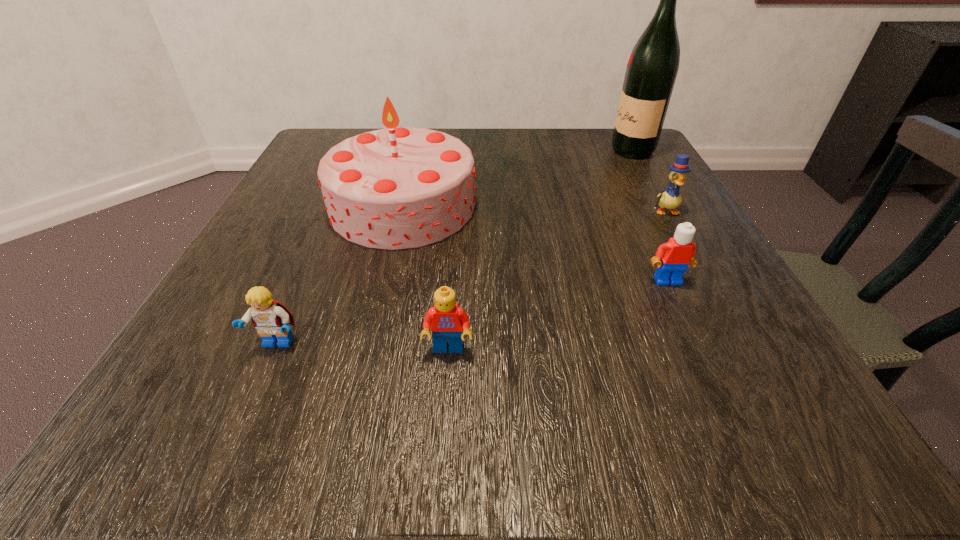
Find the location of a particular element. This screenshot has width=960, height=540. the tallest object is located at coordinates (653, 65).

This screenshot has height=540, width=960. What are the coordinates of `the farthest object` in the screenshot? It's located at (653, 65).

The width and height of the screenshot is (960, 540). Find the location of `birthday cake`. birthday cake is located at coordinates (x=395, y=188).

In order to click on duckling in this screenshot , I will do `click(671, 198)`.

Where is `the third nearest object`? This screenshot has width=960, height=540. the third nearest object is located at coordinates (676, 255).

I want to click on the rightmost Lego, so click(676, 255).

This screenshot has height=540, width=960. Find the location of `the second Lego from left to right`. the second Lego from left to right is located at coordinates (446, 319).

Image resolution: width=960 pixels, height=540 pixels. Identify the location of the leftmost Lego. (271, 318).

In order to click on free space located on the front-facing side of the tallest object in this screenshot , I will do `click(463, 151)`.

You are a GUI agent. You are given a task and a screenshot of the screen. Output one action in this format:
    pyautogui.click(x=<x>, y=<y>)
    Task: Click on the vacant space located 0.140m on the front-facing side of the tallest object
    The width and height of the screenshot is (960, 540).
    Given the screenshot: What is the action you would take?
    pyautogui.click(x=548, y=151)